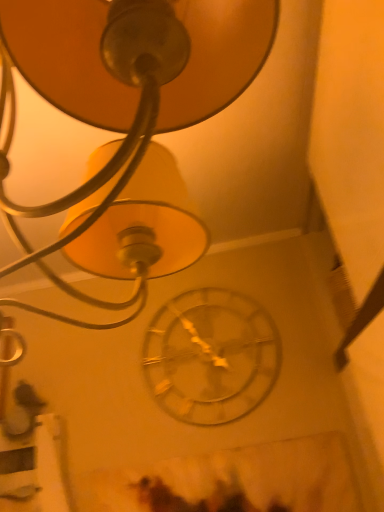
This screenshot has height=512, width=384. Describe the element at coordinates (128, 116) in the screenshot. I see `metallic gold lampshade at upper center` at that location.

Where is `metallic gold lampshade at upper center`? The width and height of the screenshot is (384, 512). metallic gold lampshade at upper center is located at coordinates (128, 116).

Measure the distance between point (x=274, y=333) and camera.

They are 1.50 meters apart.

What do you see at coordinates (210, 356) in the screenshot? This screenshot has height=512, width=384. I see `metallic silver clock at center` at bounding box center [210, 356].

Where is `metallic silver clock at center`? metallic silver clock at center is located at coordinates (210, 356).

Identify the location of metallic gold lampshade at upper center. This screenshot has width=384, height=512. (128, 116).

Between metallic gold lampshade at upper center and metallic silver clock at center, which one appears on the left side from the viewer's perspective?

Positioned to the left is metallic gold lampshade at upper center.

Is the depth of metallic gold lampshade at upper center less than that of metallic silver clock at center?

Yes, it is in front of metallic silver clock at center.

Considering the positions of points (134, 220) and (244, 370), is point (134, 220) farther from camera compared to point (244, 370)?

No, it is in front of (244, 370).

From the image's perspective, who appears lower, metallic gold lampshade at upper center or metallic silver clock at center?

metallic silver clock at center is shown below in the image.

From a real-world perspective, is metallic gold lampshade at upper center positioned above or below metallic silver clock at center?

From a real-world perspective, metallic gold lampshade at upper center is physically above metallic silver clock at center.

Is metallic gold lampshade at upper center wider than metallic silver clock at center?

Correct, the width of metallic gold lampshade at upper center exceeds that of metallic silver clock at center.

Considering the sizes of metallic gold lampshade at upper center and metallic silver clock at center in the image, is metallic gold lampshade at upper center taller or shorter than metallic silver clock at center?

Clearly, metallic gold lampshade at upper center is taller compared to metallic silver clock at center.

Who is smaller, metallic gold lampshade at upper center or metallic silver clock at center?

With smaller size is metallic silver clock at center.

Is metallic silver clock at center located within metallic gold lampshade at upper center?

No, metallic silver clock at center is not surrounded by metallic gold lampshade at upper center.

Is metallic gold lampshade at upper center in contact with metallic silver clock at center?

No, metallic gold lampshade at upper center is not with metallic silver clock at center.

Could you tell me if metallic gold lampshade at upper center is facing metallic silver clock at center?

No, metallic gold lampshade at upper center is not aimed at metallic silver clock at center.

Locate an element on the screen. This screenshot has width=384, height=512. lamp in front of the metallic silver clock at center is located at coordinates (128, 116).

Between metallic silver clock at center and metallic gold lampshade at upper center, which one appears on the right side from the viewer's perspective?

metallic silver clock at center.

Which object is further away from the camera taking this photo, metallic silver clock at center or metallic gold lampshade at upper center?

Positioned behind is metallic silver clock at center.

Is point (205, 344) in front of point (40, 266)?

That is True.

From the image's perspective, between metallic silver clock at center and metallic gold lampshade at upper center, which one is located above?

metallic gold lampshade at upper center.

From a real-world perspective, between metallic silver clock at center and metallic gold lampshade at upper center, who is vertically higher?

From a 3D spatial view, metallic gold lampshade at upper center is above.

Is metallic silver clock at center thinner than metallic gold lampshade at upper center?

Correct, the width of metallic silver clock at center is less than that of metallic gold lampshade at upper center.

Is metallic silver clock at center taller than metallic gold lampshade at upper center?

Incorrect, the height of metallic silver clock at center is not larger of that of metallic gold lampshade at upper center.

Considering the sizes of metallic silver clock at center and metallic gold lampshade at upper center in the image, is metallic silver clock at center bigger or smaller than metallic gold lampshade at upper center?

In the image, metallic silver clock at center appears to be smaller than metallic gold lampshade at upper center.

Is metallic silver clock at center positioned beyond the bounds of metallic gold lampshade at upper center?

Absolutely, metallic silver clock at center is external to metallic gold lampshade at upper center.

Is metallic silver clock at center not near metallic gold lampshade at upper center?

No, metallic silver clock at center is not far away from metallic gold lampshade at upper center.

Is metallic silver clock at center turned away from metallic gold lampshade at upper center?

No, metallic gold lampshade at upper center is not at the back of metallic silver clock at center.

You are a GUI agent. You are given a task and a screenshot of the screen. Output one action in this format:
    pyautogui.click(x=<x>, y=<y>)
    Task: Click on the wall clock beneath the metallic gold lampshade at upper center (from a real-world perspective)
    The height and width of the screenshot is (512, 384).
    Given the screenshot: What is the action you would take?
    click(210, 356)

The width and height of the screenshot is (384, 512). Find the location of `lamp in front of the metallic silver clock at center`. lamp in front of the metallic silver clock at center is located at coordinates (128, 116).

At what (x,y) coordinates should I click in order to perform the action: click on lamp on the left of metallic silver clock at center. Please return your answer as a coordinate pair (x, y). The width and height of the screenshot is (384, 512). Looking at the image, I should click on (128, 116).